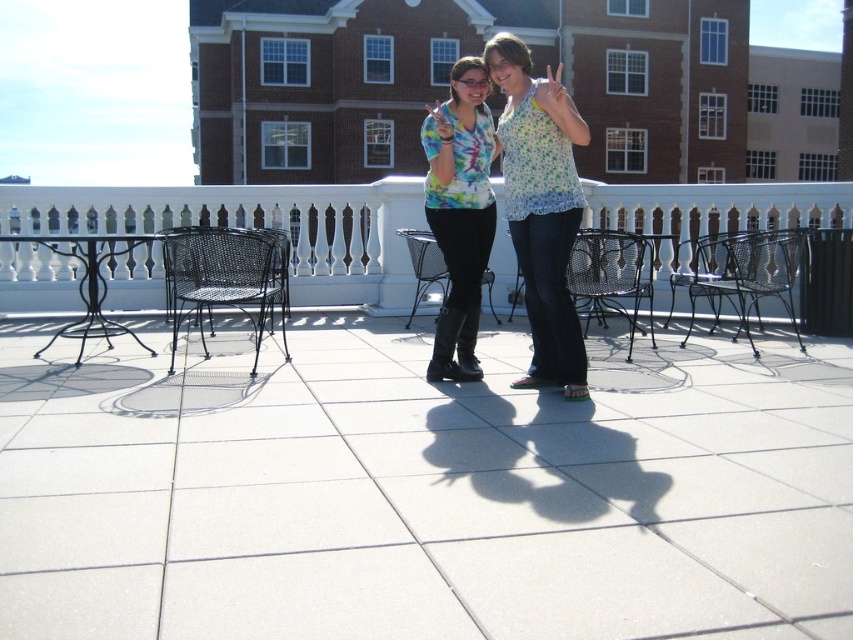
You are planning to place a small potted plant on the white tile balcony at center. Considering the space available, will the balcony be able to accommodate the plant without overlapping with the floral fabric blouse at center?

The white tile balcony at center occupies less space than the floral fabric blouse at center, so it may not have enough space to place the potted plant without overlapping with the floral fabric blouse at center.

You are planning to place a new potted plant between the black wicker chair at left and the black metal bench at right on the rooftop patio. Based on their positions, where should you position the plant to ensure it is centered between them?

The black wicker chair at left is to the left of the black metal bench at right, so placing the potted plant exactly halfway between them would center it between the two objects.